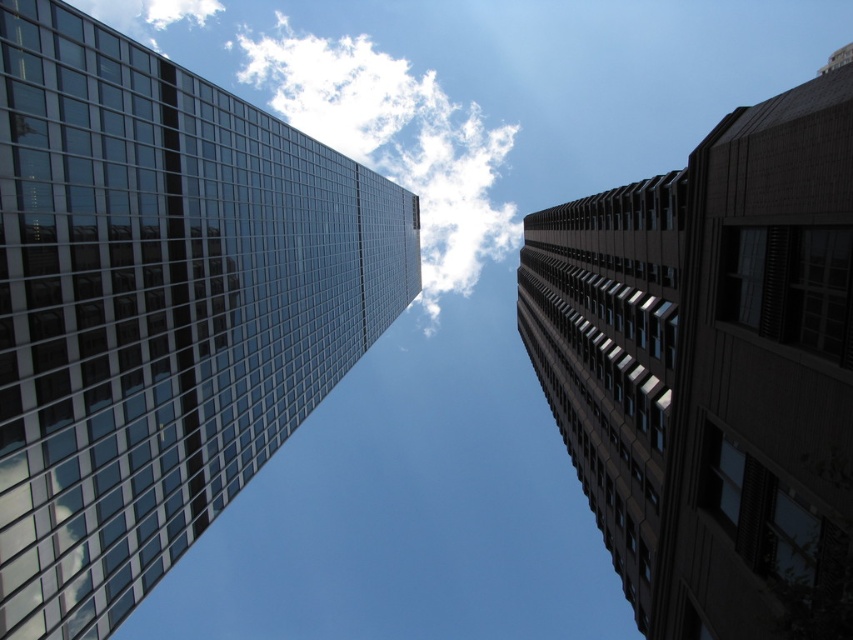
The height and width of the screenshot is (640, 853). Identify the location of brown brick building at upper right. (712, 369).

Does brown brick building at upper right come behind white fluffy cloud at upper center?

No, it is in front of white fluffy cloud at upper center.

Between point (788, 534) and point (473, 150), which one is positioned in front?

Point (788, 534) is in front.

Locate an element on the screen. Image resolution: width=853 pixels, height=640 pixels. brown brick building at upper right is located at coordinates click(x=712, y=369).

Between point (64, 509) and point (447, 173), which one is positioned in front?

Positioned in front is point (64, 509).

Based on the photo, can you confirm if glassy reflective skyscraper at left is shorter than white fluffy cloud at upper center?

Indeed, glassy reflective skyscraper at left has a lesser height compared to white fluffy cloud at upper center.

Between point (38, 145) and point (427, 256), which one is positioned behind?

Point (427, 256)

This screenshot has width=853, height=640. Find the location of `glassy reflective skyscraper at left`. glassy reflective skyscraper at left is located at coordinates (160, 307).

Can you confirm if glassy reflective skyscraper at left is positioned below brown brick building at upper right?

No.

Where is `glassy reflective skyscraper at left`? This screenshot has height=640, width=853. glassy reflective skyscraper at left is located at coordinates (160, 307).

Identify the location of glassy reflective skyscraper at left. click(160, 307).